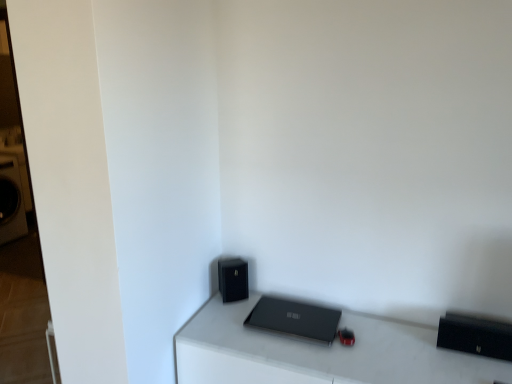
At what (x,y) coordinates should I click in order to perform the action: click on spots to the right of matte black laptop at center. Please return your answer as a coordinate pair (x, y). The width and height of the screenshot is (512, 384). Looking at the image, I should click on (366, 335).